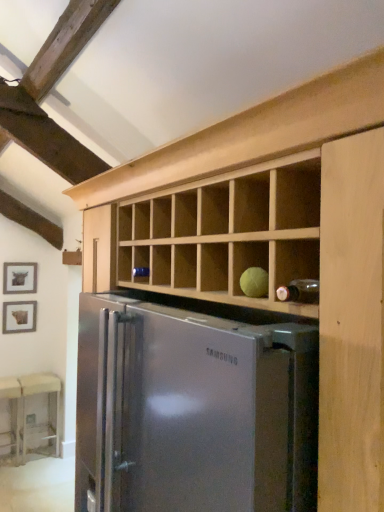
What is the approximate width of wooden table at lower left, positioned as the 2th table in right-to-left order?

It is 13.22 inches.

In order to face matte brown picture frame at left, positioned as the 2th picture frame in top-to-bottom order, should I rotate leftwards or rightwards?

To align with it, rotate left about 21.939°.

What are the coordinates of `beige fabric table at lower left, positioned as the 2th table in left-to-right order` in the screenshot? It's located at (25, 406).

Describe the element at coordinates (25, 406) in the screenshot. This screenshot has height=512, width=384. I see `beige fabric table at lower left, which appears as the 1th table when viewed from the right` at that location.

What do you see at coordinates (193, 410) in the screenshot?
I see `stainless steel refrigerator at center` at bounding box center [193, 410].

Where is `wooden table at lower left, positioned as the 2th table in right-to-left order`? The width and height of the screenshot is (384, 512). wooden table at lower left, positioned as the 2th table in right-to-left order is located at coordinates (12, 398).

Considering the sizes of objects stainless steel refrigerator at center and beige fabric table at lower left, positioned as the 2th table in left-to-right order, in the image provided, who is smaller, stainless steel refrigerator at center or beige fabric table at lower left, positioned as the 2th table in left-to-right order,?

beige fabric table at lower left, positioned as the 2th table in left-to-right order, is smaller.

Considering the relative sizes of stainless steel refrigerator at center and beige fabric table at lower left, which appears as the 1th table when viewed from the right, in the image provided, is stainless steel refrigerator at center shorter than beige fabric table at lower left, which appears as the 1th table when viewed from the right,?

Incorrect, the height of stainless steel refrigerator at center does not fall short of that of beige fabric table at lower left, which appears as the 1th table when viewed from the right.

Locate an element on the screen. The height and width of the screenshot is (512, 384). refrigerator on the right of beige fabric table at lower left, positioned as the 2th table in left-to-right order is located at coordinates (193, 410).

Consider the image. Is stainless steel refrigerator at center wider than beige fabric table at lower left, which appears as the 1th table when viewed from the right?

Indeed, stainless steel refrigerator at center has a greater width compared to beige fabric table at lower left, which appears as the 1th table when viewed from the right.

From a real-world perspective, is beige fabric table at lower left, which appears as the 1th table when viewed from the right, above or below matte black picture frame at left, the 2th picture frame in the bottom-to-top sequence?

From a real-world perspective, beige fabric table at lower left, which appears as the 1th table when viewed from the right, is physically below matte black picture frame at left, the 2th picture frame in the bottom-to-top sequence.

Measure the distance from beige fabric table at lower left, positioned as the 2th table in left-to-right order, to matte black picture frame at left, arranged as the 1th picture frame when viewed from the top.

beige fabric table at lower left, positioned as the 2th table in left-to-right order, is 1.08 meters away from matte black picture frame at left, arranged as the 1th picture frame when viewed from the top.

Consider the image. Can you confirm if beige fabric table at lower left, positioned as the 2th table in left-to-right order, is taller than matte black picture frame at left, arranged as the 1th picture frame when viewed from the top?

Yes, beige fabric table at lower left, positioned as the 2th table in left-to-right order, is taller than matte black picture frame at left, arranged as the 1th picture frame when viewed from the top.

Does beige fabric table at lower left, which appears as the 1th table when viewed from the right, appear on the right side of matte black picture frame at left, arranged as the 1th picture frame when viewed from the top?

Indeed, beige fabric table at lower left, which appears as the 1th table when viewed from the right, is positioned on the right side of matte black picture frame at left, arranged as the 1th picture frame when viewed from the top.

From a real-world perspective, which is physically below, wooden table at lower left, the 1th table in the left-to-right sequence, or stainless steel refrigerator at center?

wooden table at lower left, the 1th table in the left-to-right sequence, from a real-world perspective.

Consider the image. Would you say wooden table at lower left, positioned as the 2th table in right-to-left order, is inside or outside stainless steel refrigerator at center?

wooden table at lower left, positioned as the 2th table in right-to-left order, exists outside the volume of stainless steel refrigerator at center.

Consider the image. How different are the orientations of wooden table at lower left, the 1th table in the left-to-right sequence, and stainless steel refrigerator at center in degrees?

wooden table at lower left, the 1th table in the left-to-right sequence, and stainless steel refrigerator at center are facing 90.6 degrees away from each other.

Between matte black picture frame at left, arranged as the 1th picture frame when viewed from the top, and wooden table at lower left, positioned as the 2th table in right-to-left order, which one has less height?

matte black picture frame at left, arranged as the 1th picture frame when viewed from the top, is shorter.

From a real-world perspective, does matte black picture frame at left, the 2th picture frame in the bottom-to-top sequence, sit lower than wooden table at lower left, positioned as the 2th table in right-to-left order?

No, from a real-world perspective, matte black picture frame at left, the 2th picture frame in the bottom-to-top sequence, is not below wooden table at lower left, positioned as the 2th table in right-to-left order.

Considering the positions of objects matte black picture frame at left, the 2th picture frame in the bottom-to-top sequence, and wooden table at lower left, the 1th table in the left-to-right sequence, in the image provided, who is more to the right, matte black picture frame at left, the 2th picture frame in the bottom-to-top sequence, or wooden table at lower left, the 1th table in the left-to-right sequence,?

From the viewer's perspective, matte black picture frame at left, the 2th picture frame in the bottom-to-top sequence, appears more on the right side.

In terms of size, does stainless steel refrigerator at center appear bigger or smaller than matte brown picture frame at left, which is the 1th picture frame from bottom to top?

Clearly, stainless steel refrigerator at center is larger in size than matte brown picture frame at left, which is the 1th picture frame from bottom to top.

You are a GUI agent. You are given a task and a screenshot of the screen. Output one action in this format:
    pyautogui.click(x=<x>, y=<y>)
    Task: Click on the refrigerator located above the matte brown picture frame at left, positioned as the 2th picture frame in top-to-bottom order (from a real-world perspective)
    The height and width of the screenshot is (512, 384).
    Given the screenshot: What is the action you would take?
    pyautogui.click(x=193, y=410)

Is stainless steel refrigerator at center aimed at matte brown picture frame at left, which is the 1th picture frame from bottom to top?

No, stainless steel refrigerator at center is not turned towards matte brown picture frame at left, which is the 1th picture frame from bottom to top.

Is stainless steel refrigerator at center not inside matte brown picture frame at left, positioned as the 2th picture frame in top-to-bottom order?

stainless steel refrigerator at center lies outside matte brown picture frame at left, positioned as the 2th picture frame in top-to-bottom order,'s area.

Visually, is beige fabric table at lower left, positioned as the 2th table in left-to-right order, positioned to the left or to the right of matte brown picture frame at left, which is the 1th picture frame from bottom to top?

Based on their positions, beige fabric table at lower left, positioned as the 2th table in left-to-right order, is located to the right of matte brown picture frame at left, which is the 1th picture frame from bottom to top.

From a real-world perspective, is beige fabric table at lower left, which appears as the 1th table when viewed from the right, under matte brown picture frame at left, positioned as the 2th picture frame in top-to-bottom order?

Correct, in the physical world, beige fabric table at lower left, which appears as the 1th table when viewed from the right, is lower than matte brown picture frame at left, positioned as the 2th picture frame in top-to-bottom order.

Which picture frame is the 2nd one when counting from the left side of the beige fabric table at lower left, positioned as the 2th table in left-to-right order? Please provide its 2D coordinates.

[(19, 317)]

From a real-world perspective, is wooden table at lower left, the 1th table in the left-to-right sequence, over matte black picture frame at left, arranged as the 1th picture frame when viewed from the top?

No, from a real-world perspective, wooden table at lower left, the 1th table in the left-to-right sequence, is not on top of matte black picture frame at left, arranged as the 1th picture frame when viewed from the top.

Which is less distant, (18,455) or (16,267)?

Point (18,455) is closer to the camera than point (16,267).

Is wooden table at lower left, positioned as the 2th table in right-to-left order, inside the boundaries of matte black picture frame at left, the 2th picture frame in the bottom-to-top sequence, or outside?

wooden table at lower left, positioned as the 2th table in right-to-left order, is not enclosed by matte black picture frame at left, the 2th picture frame in the bottom-to-top sequence.

From the image's perspective, count 2nd picture frames upward from the wooden table at lower left, positioned as the 2th table in right-to-left order, and point to it. Please provide its 2D coordinates.

[(20, 278)]

Find the location of a particular element. The image size is (384, 512). table that is the 1st object directly below the stainless steel refrigerator at center (from a real-world perspective) is located at coordinates (25, 406).

Locate an element on the screen. table to the right of matte black picture frame at left, the 2th picture frame in the bottom-to-top sequence is located at coordinates (25, 406).

Looking at the image, which one is located further to beige fabric table at lower left, positioned as the 2th table in left-to-right order, matte brown picture frame at left, positioned as the 2th picture frame in top-to-bottom order, or wooden table at lower left, positioned as the 2th table in right-to-left order?

Among the two, matte brown picture frame at left, positioned as the 2th picture frame in top-to-bottom order, is located further to beige fabric table at lower left, positioned as the 2th table in left-to-right order.

Looking at the image, which one is located further to beige fabric table at lower left, positioned as the 2th table in left-to-right order, stainless steel refrigerator at center or wooden table at lower left, the 1th table in the left-to-right sequence?

stainless steel refrigerator at center lies further to beige fabric table at lower left, positioned as the 2th table in left-to-right order, than the other object.

Estimate the real-world distances between objects in this image. Which object is further from stainless steel refrigerator at center, wooden table at lower left, the 1th table in the left-to-right sequence, or matte black picture frame at left, the 2th picture frame in the bottom-to-top sequence?

matte black picture frame at left, the 2th picture frame in the bottom-to-top sequence.

When comparing their distances from matte brown picture frame at left, positioned as the 2th picture frame in top-to-bottom order, does stainless steel refrigerator at center or matte black picture frame at left, the 2th picture frame in the bottom-to-top sequence, seem further?

Based on the image, stainless steel refrigerator at center appears to be further to matte brown picture frame at left, positioned as the 2th picture frame in top-to-bottom order.

Estimate the real-world distances between objects in this image. Which object is closer to stainless steel refrigerator at center, matte brown picture frame at left, positioned as the 2th picture frame in top-to-bottom order, or wooden table at lower left, positioned as the 2th table in right-to-left order?

Based on the image, wooden table at lower left, positioned as the 2th table in right-to-left order, appears to be nearer to stainless steel refrigerator at center.

Which object lies nearer to the anchor point wooden table at lower left, the 1th table in the left-to-right sequence, beige fabric table at lower left, which appears as the 1th table when viewed from the right, or matte black picture frame at left, the 2th picture frame in the bottom-to-top sequence?

beige fabric table at lower left, which appears as the 1th table when viewed from the right, is closer to wooden table at lower left, the 1th table in the left-to-right sequence.

From the image, which object appears to be nearer to wooden table at lower left, the 1th table in the left-to-right sequence, stainless steel refrigerator at center or matte black picture frame at left, arranged as the 1th picture frame when viewed from the top?

Based on the image, matte black picture frame at left, arranged as the 1th picture frame when viewed from the top, appears to be nearer to wooden table at lower left, the 1th table in the left-to-right sequence.

When comparing their distances from matte brown picture frame at left, positioned as the 2th picture frame in top-to-bottom order, does beige fabric table at lower left, which appears as the 1th table when viewed from the right, or matte black picture frame at left, arranged as the 1th picture frame when viewed from the top, seem closer?

matte black picture frame at left, arranged as the 1th picture frame when viewed from the top, is closer to matte brown picture frame at left, positioned as the 2th picture frame in top-to-bottom order.

The height and width of the screenshot is (512, 384). In order to click on picture frame that lies between matte black picture frame at left, arranged as the 1th picture frame when viewed from the top, and beige fabric table at lower left, which appears as the 1th table when viewed from the right, from top to bottom in this screenshot , I will do `click(19, 317)`.

Find the location of a particular element. This screenshot has height=512, width=384. picture frame located between stainless steel refrigerator at center and matte black picture frame at left, the 2th picture frame in the bottom-to-top sequence, in the depth direction is located at coordinates (19, 317).

I want to click on table between matte black picture frame at left, arranged as the 1th picture frame when viewed from the top, and beige fabric table at lower left, which appears as the 1th table when viewed from the right, in the up-down direction, so click(x=12, y=398).

This screenshot has width=384, height=512. In order to click on table between matte brown picture frame at left, positioned as the 2th picture frame in top-to-bottom order, and beige fabric table at lower left, positioned as the 2th table in left-to-right order, vertically in this screenshot , I will do click(x=12, y=398).